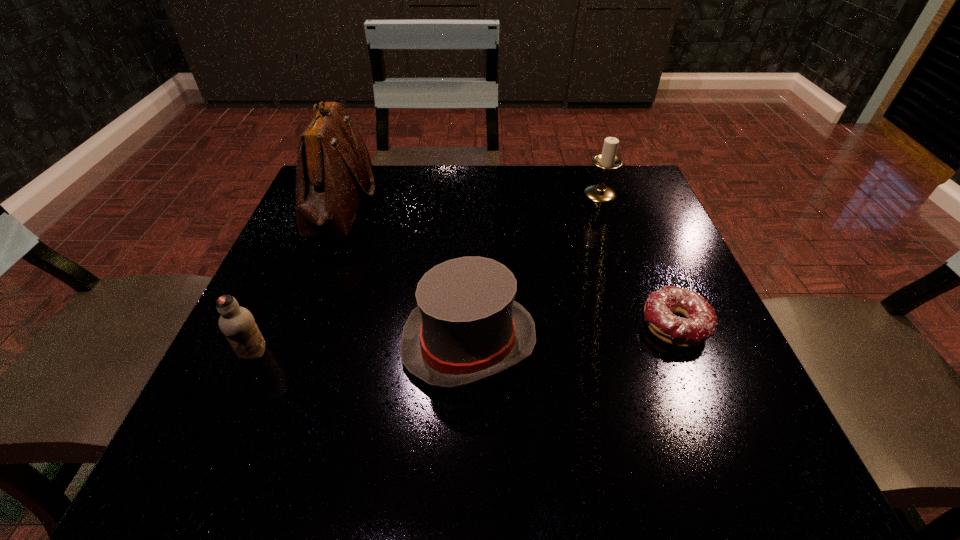
Identify the location of vacant space at the right edge of the desktop. The width and height of the screenshot is (960, 540). (714, 382).

In the image, there is a desktop. Where is `free space at the near left corner`? Image resolution: width=960 pixels, height=540 pixels. free space at the near left corner is located at coordinates (291, 418).

In the image, there is a desktop. Where is `vacant space at the near right corner`? This screenshot has height=540, width=960. vacant space at the near right corner is located at coordinates (758, 443).

The width and height of the screenshot is (960, 540). Find the location of `free space that is in between the chocolate milk and the dress hat`. free space that is in between the chocolate milk and the dress hat is located at coordinates (362, 348).

Locate an element on the screen. This screenshot has width=960, height=540. vacant space that is in between the third object from left to right and the chocolate milk is located at coordinates (x=362, y=348).

Identify the location of free space between the shortest object and the shoulder bag. The image size is (960, 540). (508, 263).

The image size is (960, 540). I want to click on vacant region between the shoulder bag and the chocolate milk, so click(x=298, y=278).

The height and width of the screenshot is (540, 960). Find the location of `blank region between the candle holder and the third object from right to left`. blank region between the candle holder and the third object from right to left is located at coordinates (535, 268).

This screenshot has width=960, height=540. Identify the location of free space between the tallest object and the dress hat. (405, 272).

The height and width of the screenshot is (540, 960). I want to click on vacant region between the third object from right to left and the tallest object, so click(x=405, y=272).